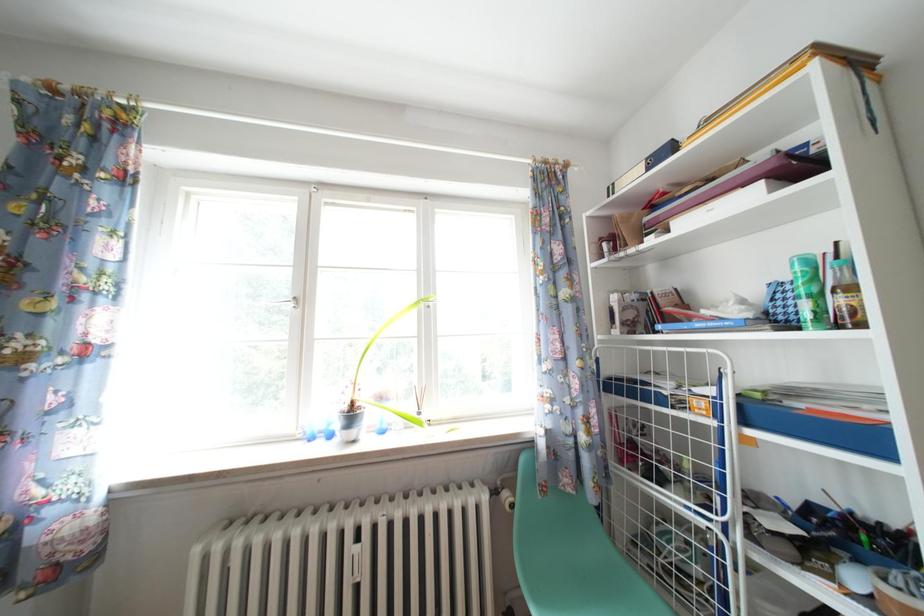
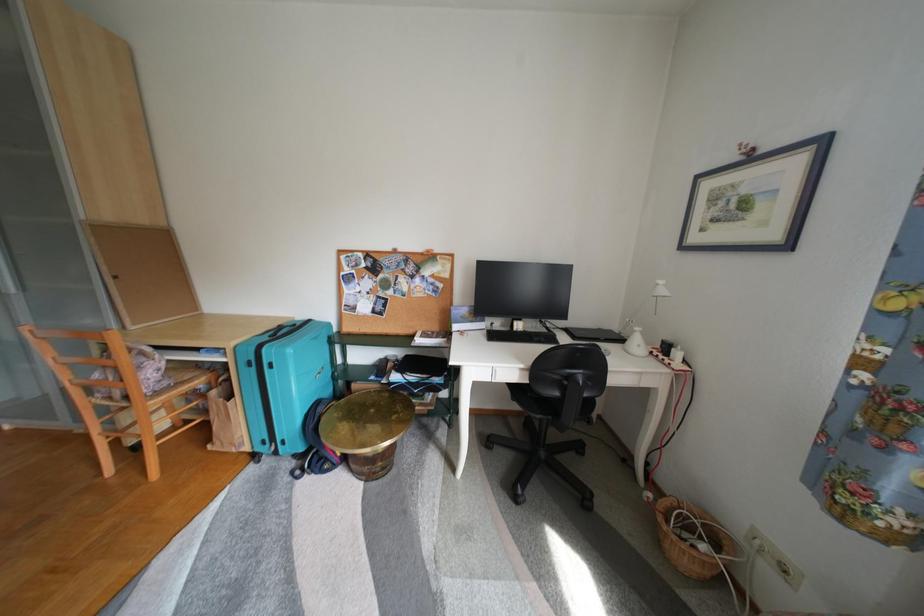
Question: The first image is from the beginning of the video and the second image is from the end. How did the camera likely rotate when shooting the video?

Choices:
 (A) Left
 (B) Right
 (C) Up
 (D) Down

Answer: (A)